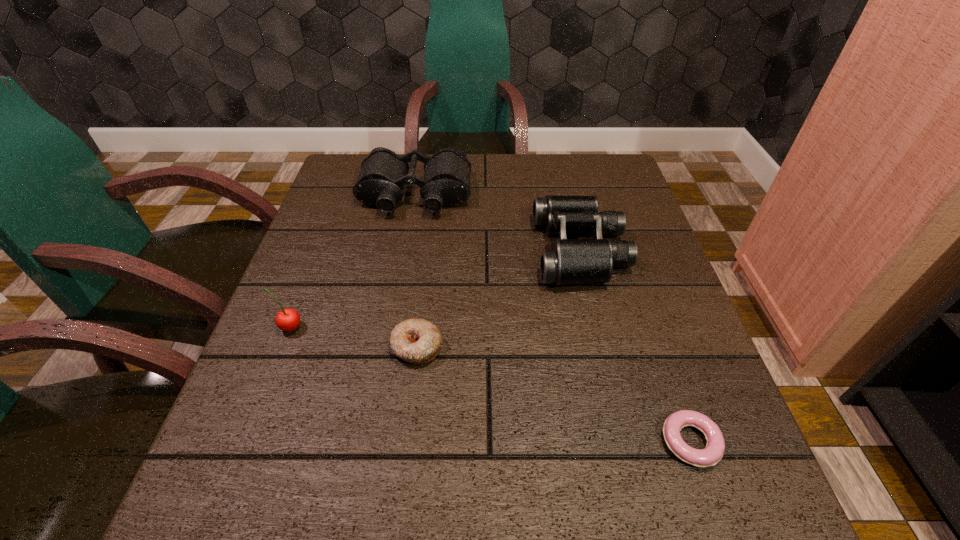
Identify the location of free area in between the right binoculars and the nearest object. (636, 346).

In order to click on free space that is in between the right binoculars and the cherry in this screenshot , I will do `click(435, 289)`.

Identify the location of free space that is in between the left doughnut and the right binoculars. This screenshot has width=960, height=540. (499, 298).

Where is `empty space between the left binoculars and the cherry`? Image resolution: width=960 pixels, height=540 pixels. empty space between the left binoculars and the cherry is located at coordinates (352, 261).

Locate an element on the screen. The image size is (960, 540). vacant space that is in between the leftmost object and the right doughnut is located at coordinates [491, 385].

Locate which object is the third closest to the left binoculars. Please provide its 2D coordinates. Your answer should be formatted as a tuple, i.e. [(x, y)], where the tuple contains the x and y coordinates of a point satisfying the conditions above.

[(417, 341)]

At what (x,y) coordinates should I click in order to perform the action: click on object that stands as the fourth closest to the cherry. Please return your answer as a coordinate pair (x, y). This screenshot has height=540, width=960. Looking at the image, I should click on (713, 452).

Find the location of a particular element. free spot that satisfies the following two spatial constraints: 1. on the front-facing side of the right binoculars; 2. on the back side of the shorter doughnut is located at coordinates (627, 442).

This screenshot has width=960, height=540. Find the location of `free space that satisfies the following two spatial constraints: 1. on the front-facing side of the right binoculars; 2. on the front side of the left doughnut`. free space that satisfies the following two spatial constraints: 1. on the front-facing side of the right binoculars; 2. on the front side of the left doughnut is located at coordinates (604, 347).

You are a GUI agent. You are given a task and a screenshot of the screen. Output one action in this format:
    pyautogui.click(x=<x>, y=<y>)
    Task: Click on the vacant space that satisfies the following two spatial constraints: 1. through the eyepieces of the left doughnut; 2. on the left side of the left binoculars
    The image size is (960, 540).
    Given the screenshot: What is the action you would take?
    pyautogui.click(x=389, y=347)